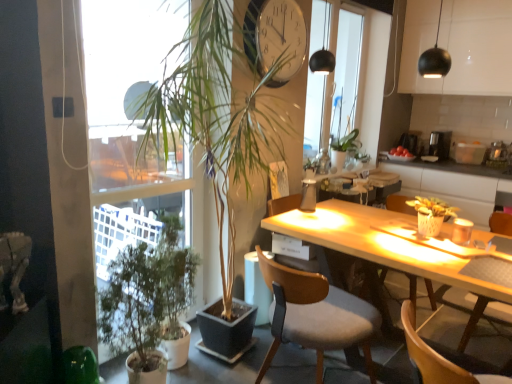
Question: Is translucent glass bottle at center, marked as the 1th bottle in a top-to-bottom arrangement, shorter than wooden chair at center, the first chair when ordered from back to front?

Choices:
 (A) no
 (B) yes

Answer: (B)

Question: Does translucent glass bottle at center, arranged as the 1th bottle when viewed from the right, have a greater width compared to wooden chair at center, the first chair when ordered from back to front?

Choices:
 (A) yes
 (B) no

Answer: (B)

Question: Is the position of translucent glass bottle at center, marked as the 1th bottle in a top-to-bottom arrangement, more distant than that of wooden chair at center, which appears as the 3th chair when viewed from the front?

Choices:
 (A) yes
 (B) no

Answer: (A)

Question: Can you confirm if translucent glass bottle at center, positioned as the first bottle in back-to-front order, is thinner than wooden chair at center, which appears as the 3th chair when viewed from the front?

Choices:
 (A) yes
 (B) no

Answer: (A)

Question: From a real-world perspective, does translucent glass bottle at center, the second bottle positioned from the left, stand above wooden chair at center, which appears as the 3th chair when viewed from the front?

Choices:
 (A) yes
 (B) no

Answer: (A)

Question: Considering the positions of point (444, 203) and point (289, 19), is point (444, 203) closer or farther from the camera than point (289, 19)?

Choices:
 (A) closer
 (B) farther

Answer: (B)

Question: Is green matte plant at right, which ranks as the third houseplant in left-to-right order, bigger or smaller than metallic clock at upper center?

Choices:
 (A) big
 (B) small

Answer: (B)

Question: In terms of width, does green matte plant at right, the 1th houseplant viewed from the right, look wider or thinner when compared to metallic clock at upper center?

Choices:
 (A) wide
 (B) thin

Answer: (A)

Question: From a real-world perspective, is green matte plant at right, the 1th houseplant viewed from the right, above or below metallic clock at upper center?

Choices:
 (A) above
 (B) below

Answer: (B)

Question: Is point (432, 77) positioned closer to the camera than point (409, 319)?

Choices:
 (A) closer
 (B) farther

Answer: (B)

Question: Is matte black sphere at upper right, which ranks as the 2th lamp in left-to-right order, inside the boundaries of wooden chair at lower right, which is the 3th chair from back to front, or outside?

Choices:
 (A) outside
 (B) inside

Answer: (A)

Question: In terms of size, does matte black sphere at upper right, which ranks as the 2th lamp in left-to-right order, appear bigger or smaller than wooden chair at lower right, which is the 3th chair from back to front?

Choices:
 (A) small
 (B) big

Answer: (A)

Question: From the image's perspective, is matte black sphere at upper right, which ranks as the 2th lamp in left-to-right order, located above or below wooden chair at lower right, acting as the first chair starting from the front?

Choices:
 (A) below
 (B) above

Answer: (B)

Question: Based on their sizes in the image, would you say green matte plant at left, which is counted as the 1th houseplant, starting from the left, is bigger or smaller than translucent glass bottle at center, positioned as the first bottle in back-to-front order?

Choices:
 (A) small
 (B) big

Answer: (B)

Question: Looking at their shapes, would you say green matte plant at left, which is counted as the 1th houseplant, starting from the left, is wider or thinner than translucent glass bottle at center, the second bottle when ordered from front to back?

Choices:
 (A) wide
 (B) thin

Answer: (A)